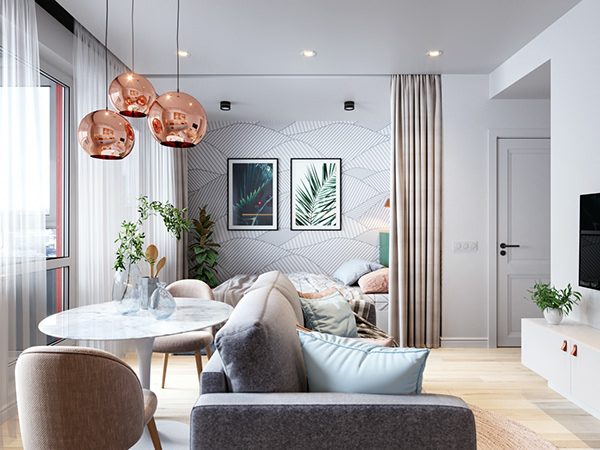
The width and height of the screenshot is (600, 450). Find the location of `curtain`. curtain is located at coordinates tap(419, 249).